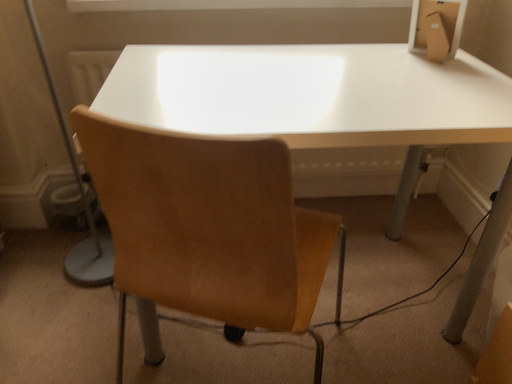
What are the coordinates of `vacant space underneath white glossy table at center (from a real-world perspective)` in the screenshot? It's located at (376, 302).